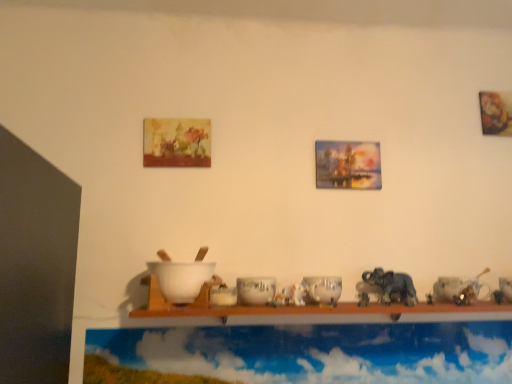
Where is `white glossy bowl at center, which ranks as the 1th tableware in left-to-right order`? white glossy bowl at center, which ranks as the 1th tableware in left-to-right order is located at coordinates (223, 296).

The width and height of the screenshot is (512, 384). What do you see at coordinates (176, 143) in the screenshot?
I see `matte wooden picture frame at upper center, marked as the 2th picture frame in a right-to-left arrangement` at bounding box center [176, 143].

Measure the distance between point [207,124] and camera.

Point [207,124] is 5.24 feet away from camera.

What is the approximate width of cloudy sky at upper center?

cloudy sky at upper center is 1.11 inches in width.

Where is `oil painting ship at center, positioned as the second picture frame in left-to-right order`? oil painting ship at center, positioned as the second picture frame in left-to-right order is located at coordinates (348, 165).

Is white glossy bowl at center, which ranks as the 1th tableware in left-to-right order, positioned with its back to matte ceramic vase at center, positioned as the 3th tableware in left-to-right order?

No, white glossy bowl at center, which ranks as the 1th tableware in left-to-right order, is not facing the opposite direction of matte ceramic vase at center, positioned as the 3th tableware in left-to-right order.

Where is `the 2nd tableware in front of the matte ceramic vase at center, positioned as the 3th tableware in left-to-right order`? the 2nd tableware in front of the matte ceramic vase at center, positioned as the 3th tableware in left-to-right order is located at coordinates (223, 296).

Considering the sizes of objects white glossy bowl at center, the fourth tableware positioned from the right, and matte ceramic vase at center, positioned as the 3th tableware in left-to-right order, in the image provided, who is taller, white glossy bowl at center, the fourth tableware positioned from the right, or matte ceramic vase at center, positioned as the 3th tableware in left-to-right order,?

Standing taller between the two is matte ceramic vase at center, positioned as the 3th tableware in left-to-right order.

Can you tell me how much cloudy sky at upper center and white matte mixing bowl at center differ in facing direction?

The facing directions of cloudy sky at upper center and white matte mixing bowl at center are 0.701 degrees apart.

Do you think cloudy sky at upper center is within white matte mixing bowl at center, or outside of it?

cloudy sky at upper center is located beyond the bounds of white matte mixing bowl at center.

From a real-world perspective, which object rests below the other?

From a 3D spatial view, cloudy sky at upper center is below.

Is point (507, 294) behind point (390, 300)?

No.

Is white glossy bowl at center, the fourth tableware from the left, located outside metallic gray elephant at lower right?

Indeed, white glossy bowl at center, the fourth tableware from the left, is completely outside metallic gray elephant at lower right.

At what (x,y) coordinates should I click in order to perform the action: click on the 2nd tableware below the metallic gray elephant at lower right (from the image's perspective). Please return your answer as a coordinate pair (x, y). Looking at the image, I should click on (506, 287).

Considering the positions of objects white glossy bowl at center, the fourth tableware from the left, and metallic gray elephant at lower right in the image provided, who is more to the left, white glossy bowl at center, the fourth tableware from the left, or metallic gray elephant at lower right?

Positioned to the left is metallic gray elephant at lower right.

How different are the orientations of white glossy bowl at center, which is the 2th tableware in left-to-right order, and white glossy bowl at center, the fourth tableware from the left, in degrees?

There is a 0.000167-degree angle between the facing directions of white glossy bowl at center, which is the 2th tableware in left-to-right order, and white glossy bowl at center, the fourth tableware from the left.

Who is more distant, white glossy bowl at center, which is the 2th tableware in left-to-right order, or white glossy bowl at center, the fourth tableware from the left?

white glossy bowl at center, the fourth tableware from the left, is further from the camera.

The image size is (512, 384). In order to click on tableware above the white glossy bowl at center, the fourth tableware from the left (from a real-world perspective) in this screenshot , I will do `click(256, 290)`.

Is white glossy bowl at center, which is the 2th tableware in left-to-right order, looking in the opposite direction of white glossy bowl at center, which appears as the first tableware when viewed from the right?

No, white glossy bowl at center, which is the 2th tableware in left-to-right order, is not facing away from white glossy bowl at center, which appears as the first tableware when viewed from the right.

Is point (403, 369) behind point (264, 285)?

Yes, it is.

From a real-world perspective, is cloudy sky at upper center located beneath white glossy bowl at center, which is the 2th tableware in left-to-right order?

Correct, in the physical world, cloudy sky at upper center is lower than white glossy bowl at center, which is the 2th tableware in left-to-right order.

Can you confirm if cloudy sky at upper center is bigger than white glossy bowl at center, which is the 2th tableware in left-to-right order?

Correct, cloudy sky at upper center is larger in size than white glossy bowl at center, which is the 2th tableware in left-to-right order.

Who is taller, cloudy sky at upper center or white glossy bowl at center, which is the 2th tableware in left-to-right order?

cloudy sky at upper center is taller.

Consider the image. Is matte ceramic vase at center, positioned as the 3th tableware in left-to-right order, not within metallic gray elephant at lower right?

Absolutely, matte ceramic vase at center, positioned as the 3th tableware in left-to-right order, is external to metallic gray elephant at lower right.

Between point (335, 290) and point (410, 283), which one is positioned in front?

The point (335, 290) is in front.

Which of these two, matte ceramic vase at center, positioned as the second tableware in right-to-left order, or metallic gray elephant at lower right, is thinner?

metallic gray elephant at lower right is thinner.

How much distance is there between matte ceramic vase at center, positioned as the second tableware in right-to-left order, and metallic gray elephant at lower right?

matte ceramic vase at center, positioned as the second tableware in right-to-left order, is 7.62 inches from metallic gray elephant at lower right.

How many degrees apart are the facing directions of white glossy bowl at center, the fourth tableware positioned from the right, and white glossy bowl at center, which is the 2th tableware in left-to-right order?

The facing directions of white glossy bowl at center, the fourth tableware positioned from the right, and white glossy bowl at center, which is the 2th tableware in left-to-right order, are 0.00223 degrees apart.

From a real-world perspective, relative to white glossy bowl at center, arranged as the third tableware when viewed from the right, is white glossy bowl at center, which ranks as the 1th tableware in left-to-right order, vertically above or below?

From a real-world perspective, white glossy bowl at center, which ranks as the 1th tableware in left-to-right order, is physically below white glossy bowl at center, arranged as the third tableware when viewed from the right.

Are white glossy bowl at center, which ranks as the 1th tableware in left-to-right order, and white glossy bowl at center, arranged as the third tableware when viewed from the right, making contact?

Yes, white glossy bowl at center, which ranks as the 1th tableware in left-to-right order, is touching white glossy bowl at center, arranged as the third tableware when viewed from the right.

From the matte ceramic vase at center, positioned as the second tableware in right-to-left order, count 2nd tablewares forward and point to it. Please provide its 2D coordinates.

[(223, 296)]

This screenshot has height=384, width=512. What are the coordinates of `mixing bowl above the cloudy sky at upper center (from the image's perspective)` in the screenshot? It's located at (181, 279).

Estimate the real-world distances between objects in this image. Which object is further from matte wooden picture frame at upper center, the first picture frame positioned from the left, cloudy sky at upper center or matte ceramic vase at center, positioned as the 3th tableware in left-to-right order?

cloudy sky at upper center lies further to matte wooden picture frame at upper center, the first picture frame positioned from the left, than the other object.

Consider the image. Estimate the real-world distances between objects in this image. Which object is further from white glossy bowl at center, the fourth tableware from the left, metallic gray elephant at lower right or matte wooden picture frame at upper center, marked as the 2th picture frame in a right-to-left arrangement?

Among the two, matte wooden picture frame at upper center, marked as the 2th picture frame in a right-to-left arrangement, is located further to white glossy bowl at center, the fourth tableware from the left.

Considering their positions, is white glossy bowl at center, arranged as the third tableware when viewed from the right, positioned further to white glossy bowl at center, which ranks as the 1th tableware in left-to-right order, than white matte mixing bowl at center?

white matte mixing bowl at center.

From the image, which object appears to be farther from metallic gray elephant at lower right, oil painting ship at center, positioned as the second picture frame in left-to-right order, or white glossy bowl at center, which ranks as the 1th tableware in left-to-right order?

Based on the image, white glossy bowl at center, which ranks as the 1th tableware in left-to-right order, appears to be further to metallic gray elephant at lower right.

Looking at this image, from the image, which object appears to be nearer to matte ceramic vase at center, positioned as the 3th tableware in left-to-right order, cloudy sky at upper center or white glossy bowl at center, which is the 2th tableware in left-to-right order?

white glossy bowl at center, which is the 2th tableware in left-to-right order, lies closer to matte ceramic vase at center, positioned as the 3th tableware in left-to-right order, than the other object.

When comparing their distances from cloudy sky at upper center, does white glossy bowl at center, arranged as the third tableware when viewed from the right, or matte ceramic vase at center, positioned as the 3th tableware in left-to-right order, seem further?

white glossy bowl at center, arranged as the third tableware when viewed from the right.

From the image, which object appears to be farther from metallic gray elephant at lower right, oil painting ship at center, which is the first picture frame from right to left, or white matte mixing bowl at center?

The object further to metallic gray elephant at lower right is white matte mixing bowl at center.

When comparing their distances from matte ceramic vase at center, positioned as the second tableware in right-to-left order, does matte wooden picture frame at upper center, marked as the 2th picture frame in a right-to-left arrangement, or white glossy bowl at center, which ranks as the 1th tableware in left-to-right order, seem closer?

The object closer to matte ceramic vase at center, positioned as the second tableware in right-to-left order, is white glossy bowl at center, which ranks as the 1th tableware in left-to-right order.

Image resolution: width=512 pixels, height=384 pixels. I want to click on cloud between white glossy bowl at center, which ranks as the 1th tableware in left-to-right order, and metallic gray elephant at lower right, in the horizontal direction, so click(303, 354).

At what (x,y) coordinates should I click in order to perform the action: click on cloud situated between white matte mixing bowl at center and metallic gray elephant at lower right from left to right. Please return your answer as a coordinate pair (x, y). Looking at the image, I should click on (303, 354).

At what (x,y) coordinates should I click in order to perform the action: click on cloud situated between white glossy bowl at center, the fourth tableware positioned from the right, and matte ceramic vase at center, positioned as the second tableware in right-to-left order, from left to right. Please return your answer as a coordinate pair (x, y). Looking at the image, I should click on (303, 354).

Where is `animal between matte wooden picture frame at upper center, the first picture frame positioned from the left, and white glossy bowl at center, the fourth tableware from the left, from left to right`? The height and width of the screenshot is (384, 512). animal between matte wooden picture frame at upper center, the first picture frame positioned from the left, and white glossy bowl at center, the fourth tableware from the left, from left to right is located at coordinates (392, 285).